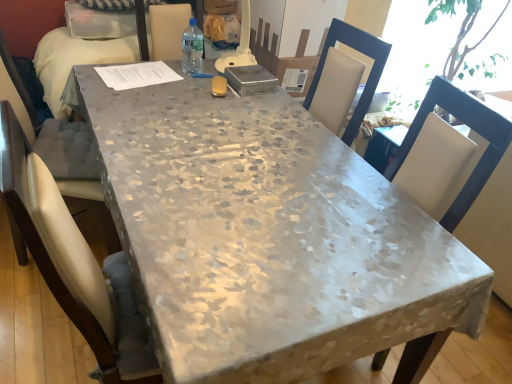
Question: In the image, is floral-patterned fabric table at center on the left side or the right side of white fabric chair at right?

Choices:
 (A) left
 (B) right

Answer: (A)

Question: Choose the correct answer: Is floral-patterned fabric table at center inside white fabric chair at right or outside it?

Choices:
 (A) outside
 (B) inside

Answer: (A)

Question: Which of these objects is positioned closest to the floral-patterned fabric table at center?

Choices:
 (A) white fabric chair at right
 (B) clear plastic bottle at center

Answer: (A)

Question: Which object is the closest to the clear plastic bottle at center?

Choices:
 (A) white fabric chair at right
 (B) floral-patterned fabric table at center

Answer: (B)